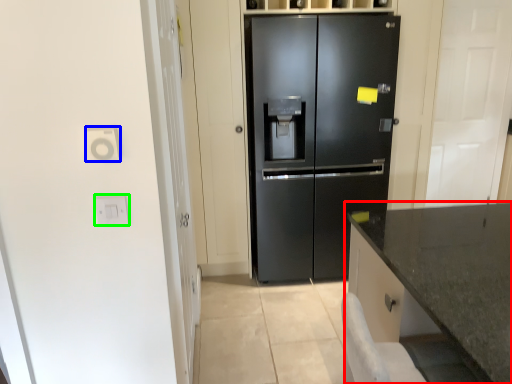
Question: Which object is positioned farthest from countertop (highlighted by a red box)? Select from electric outlet (highlighted by a blue box) and electric outlet (highlighted by a green box).

Choices:
 (A) electric outlet
 (B) electric outlet

Answer: (A)